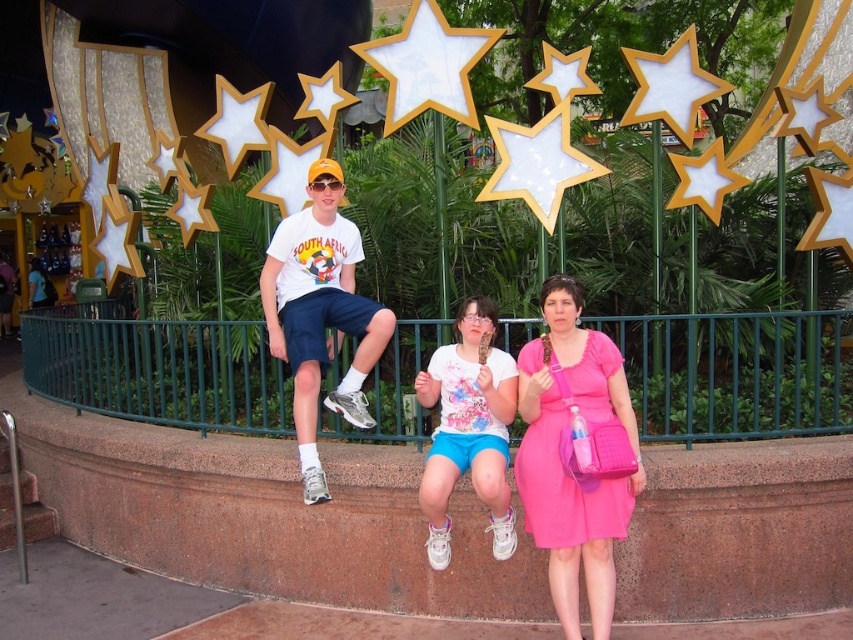
In the theme park photo, there are two people wearing a pink satin dress at center and a white matte shirt at center. Which one is positioned to the right?

The pink satin dress at center is to the right of the white matte shirt at center.

You are standing in the theme park and want to take a photo. You notice two points marked in the scene. Which point is closer to you, point [575,308] or point [515,396]?

Point [575,308] is closer to the viewer than point [515,396].